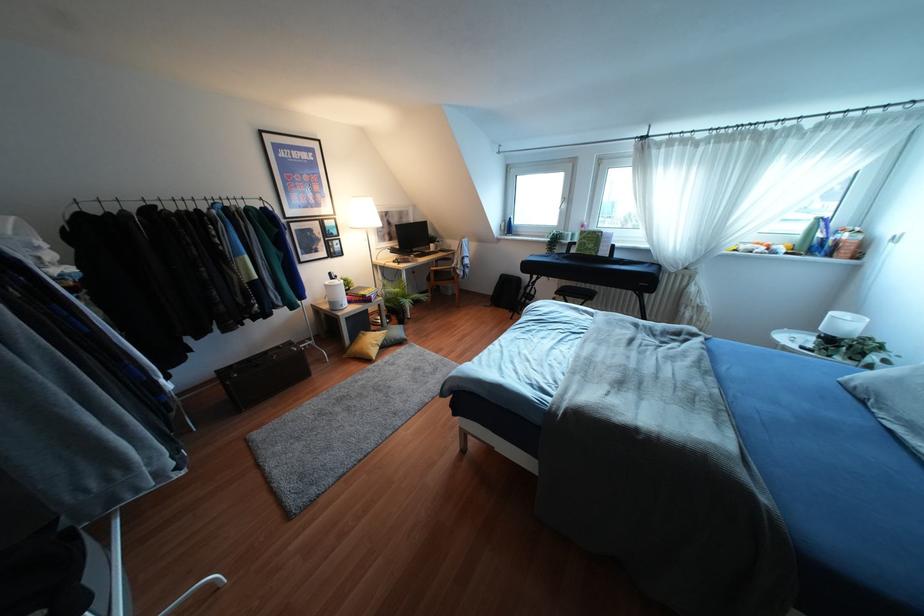
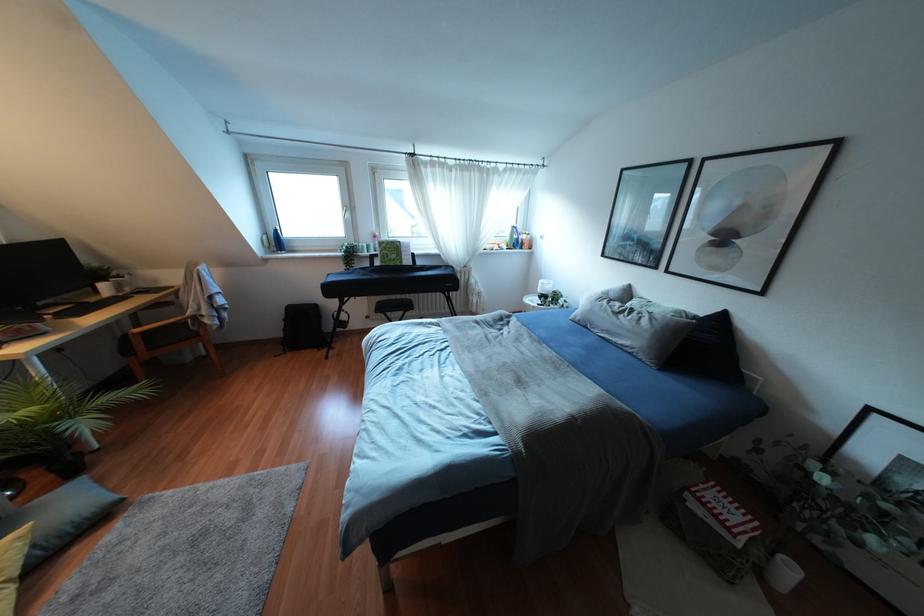
Where in the second image is the point corresponding to the point at 584,243 from the first image?

(385, 254)